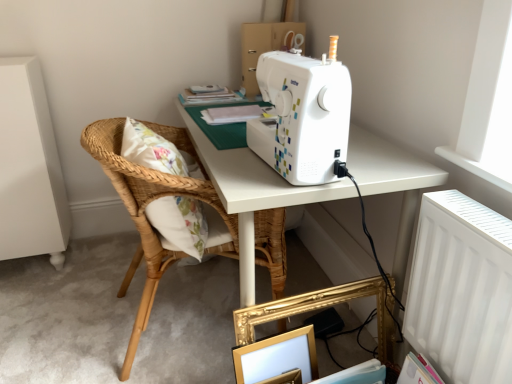
Question: Is white paper at upper center inside or outside of matte cardboard box at upper center?

Choices:
 (A) outside
 (B) inside

Answer: (A)

Question: Looking at their shapes, would you say white paper at upper center is wider or thinner than matte cardboard box at upper center?

Choices:
 (A) thin
 (B) wide

Answer: (B)

Question: Which object is the farthest from the white plastic radiator at upper right?

Choices:
 (A) gold metallic picture frame at lower center
 (B) natural woven wood pillow at left
 (C) matte cardboard box at upper center
 (D) white paper at upper center
 (E) woven wood chair at left

Answer: (C)

Question: Which object is the farthest from the matte cardboard box at upper center?

Choices:
 (A) white paper at upper center
 (B) white plastic sewing machine at upper center
 (C) woven wood chair at left
 (D) gold metallic picture frame at lower center
 (E) white plastic radiator at upper right

Answer: (D)